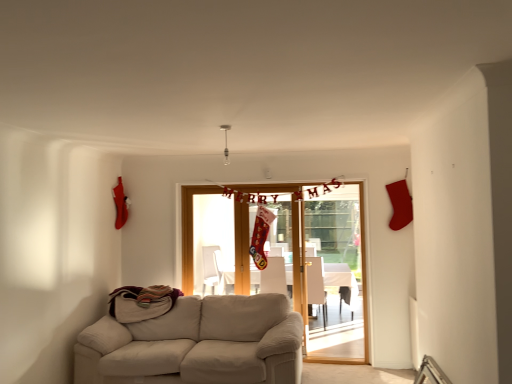
Measure the distance between wooden door at center and camera.

wooden door at center and camera are 4.65 meters apart.

Where is `white glossy table at center`? white glossy table at center is located at coordinates (341, 281).

The image size is (512, 384). Describe the element at coordinates (341, 281) in the screenshot. I see `white glossy table at center` at that location.

The width and height of the screenshot is (512, 384). I want to click on beige fabric couch at lower left, so (x=197, y=344).

Locate an element on the screen. Image resolution: width=512 pixels, height=384 pixels. matte white armchair at center, positioned as the 1th armchair in right-to-left order is located at coordinates (316, 285).

The width and height of the screenshot is (512, 384). In order to click on armchair that appears behind the matte white armchair at center, which appears as the second armchair when viewed from the left in this screenshot , I will do `click(274, 276)`.

Which of these two, white fabric armchair at center, the second armchair viewed from the right, or matte white armchair at center, positioned as the 1th armchair in right-to-left order, is bigger?

matte white armchair at center, positioned as the 1th armchair in right-to-left order, is bigger.

Which is correct: white fabric armchair at center, the second armchair viewed from the right, is inside wooden door at center, or outside of it?

white fabric armchair at center, the second armchair viewed from the right, is not inside wooden door at center, it's outside.

Is white fabric armchair at center, the second armchair viewed from the right, in front of or behind wooden door at center in the image?

Clearly, white fabric armchair at center, the second armchair viewed from the right, is behind wooden door at center.

Is white fabric armchair at center, acting as the 1th armchair starting from the left, facing away from wooden door at center?

Yes, white fabric armchair at center, acting as the 1th armchair starting from the left,'s orientation is away from wooden door at center.

From a real-world perspective, is white fabric armchair at center, the second armchair viewed from the right, over wooden door at center?

No, from a real-world perspective, white fabric armchair at center, the second armchair viewed from the right, is not above wooden door at center.

Between matte white armchair at center, which appears as the second armchair when viewed from the left, and beige fabric couch at lower left, which one appears on the right side from the viewer's perspective?

matte white armchair at center, which appears as the second armchair when viewed from the left.

Which is behind, point (310, 270) or point (176, 329)?

Positioned behind is point (310, 270).

Is matte white armchair at center, positioned as the 1th armchair in right-to-left order, positioned beyond the bounds of beige fabric couch at lower left?

Indeed, matte white armchair at center, positioned as the 1th armchair in right-to-left order, is completely outside beige fabric couch at lower left.

Can you confirm if matte white armchair at center, which appears as the second armchair when viewed from the left, is bigger than beige fabric couch at lower left?

No, matte white armchair at center, which appears as the second armchair when viewed from the left, is not bigger than beige fabric couch at lower left.

Can you tell me how much white glossy table at center and wooden door at center differ in facing direction?

91.6 degrees separate the facing orientations of white glossy table at center and wooden door at center.

From the image's perspective, is white glossy table at center beneath wooden door at center?

Yes, from the image's perspective, white glossy table at center is beneath wooden door at center.

From the picture: From a real-world perspective, is white glossy table at center above or below wooden door at center?

From a real-world perspective, white glossy table at center is physically below wooden door at center.

Which object is closer to the camera, white glossy table at center or beige fabric couch at lower left?

beige fabric couch at lower left.

From a real-world perspective, which object stands above the other?

beige fabric couch at lower left is physically above.

Can you confirm if white glossy table at center is taller than beige fabric couch at lower left?

No, white glossy table at center is not taller than beige fabric couch at lower left.

Considering the points (260, 277) and (212, 311), which point is in front, point (260, 277) or point (212, 311)?

The point (212, 311) is in front.

Is matte white armchair at center, positioned as the 1th armchair in right-to-left order, surrounding white glossy table at center?

No, white glossy table at center is not inside matte white armchair at center, positioned as the 1th armchair in right-to-left order.

From the image's perspective, is matte white armchair at center, positioned as the 1th armchair in right-to-left order, above white glossy table at center?

Indeed, from the image's perspective, matte white armchair at center, positioned as the 1th armchair in right-to-left order, is shown above white glossy table at center.

From a real-world perspective, is white fabric armchair at center, acting as the 1th armchair starting from the left, beneath white glossy table at center?

No, from a real-world perspective, white fabric armchair at center, acting as the 1th armchair starting from the left, is not below white glossy table at center.

Considering their positions, is white fabric armchair at center, acting as the 1th armchair starting from the left, located in front of or behind white glossy table at center?

Clearly, white fabric armchair at center, acting as the 1th armchair starting from the left, is in front of white glossy table at center.

Do you think white fabric armchair at center, acting as the 1th armchair starting from the left, is within white glossy table at center, or outside of it?

white fabric armchair at center, acting as the 1th armchair starting from the left, exists outside the volume of white glossy table at center.

Is point (272, 267) more distant than point (259, 272)?

No, (272, 267) is in front of (259, 272).

The height and width of the screenshot is (384, 512). I want to click on armchair below the white fabric armchair at center, the second armchair viewed from the right (from a real-world perspective), so click(x=316, y=285).

Locate an element on the screen. This screenshot has width=512, height=384. the 2nd armchair behind the wooden door at center, counting from the anchor's position is located at coordinates (274, 276).

When comparing their distances from wooden door at center, does beige fabric couch at lower left or matte white armchair at center, which appears as the second armchair when viewed from the left, seem closer?

matte white armchair at center, which appears as the second armchair when viewed from the left, is closer to wooden door at center.

Which object lies further to the anchor point white glossy table at center, wooden door at center or white fabric armchair at center, the second armchair viewed from the right?

white fabric armchair at center, the second armchair viewed from the right, is further to white glossy table at center.

When comparing their distances from white fabric armchair at center, the second armchair viewed from the right, does matte white armchair at center, which appears as the second armchair when viewed from the left, or wooden door at center seem further?

wooden door at center lies further to white fabric armchair at center, the second armchair viewed from the right, than the other object.

When comparing their distances from wooden door at center, does white fabric armchair at center, acting as the 1th armchair starting from the left, or beige fabric couch at lower left seem closer?

Among the two, white fabric armchair at center, acting as the 1th armchair starting from the left, is located nearer to wooden door at center.

From the image, which object appears to be farther from wooden door at center, white glossy table at center or white fabric armchair at center, acting as the 1th armchair starting from the left?

white glossy table at center.

Which object lies further to the anchor point wooden door at center, beige fabric couch at lower left or white fabric armchair at center, acting as the 1th armchair starting from the left?

beige fabric couch at lower left is further to wooden door at center.

When comparing their distances from white glossy table at center, does beige fabric couch at lower left or wooden door at center seem closer?

Among the two, wooden door at center is located nearer to white glossy table at center.

Based on their spatial positions, is beige fabric couch at lower left or white fabric armchair at center, acting as the 1th armchair starting from the left, further from matte white armchair at center, positioned as the 1th armchair in right-to-left order?

beige fabric couch at lower left lies further to matte white armchair at center, positioned as the 1th armchair in right-to-left order, than the other object.

This screenshot has height=384, width=512. What are the coordinates of `armchair between beige fabric couch at lower left and white fabric armchair at center, acting as the 1th armchair starting from the left, from front to back` in the screenshot? It's located at (x=316, y=285).

Locate an element on the screen. This screenshot has width=512, height=384. door between beige fabric couch at lower left and white glossy table at center from front to back is located at coordinates (291, 255).

Identify the location of door between beige fabric couch at lower left and matte white armchair at center, positioned as the 1th armchair in right-to-left order, in the front-back direction. This screenshot has width=512, height=384. (291, 255).

You are a GUI agent. You are given a task and a screenshot of the screen. Output one action in this format:
    pyautogui.click(x=<x>, y=<y>)
    Task: Click on the table between white fabric armchair at center, the second armchair viewed from the right, and matte white armchair at center, positioned as the 1th armchair in right-to-left order, from left to right
    
    Given the screenshot: What is the action you would take?
    pyautogui.click(x=341, y=281)